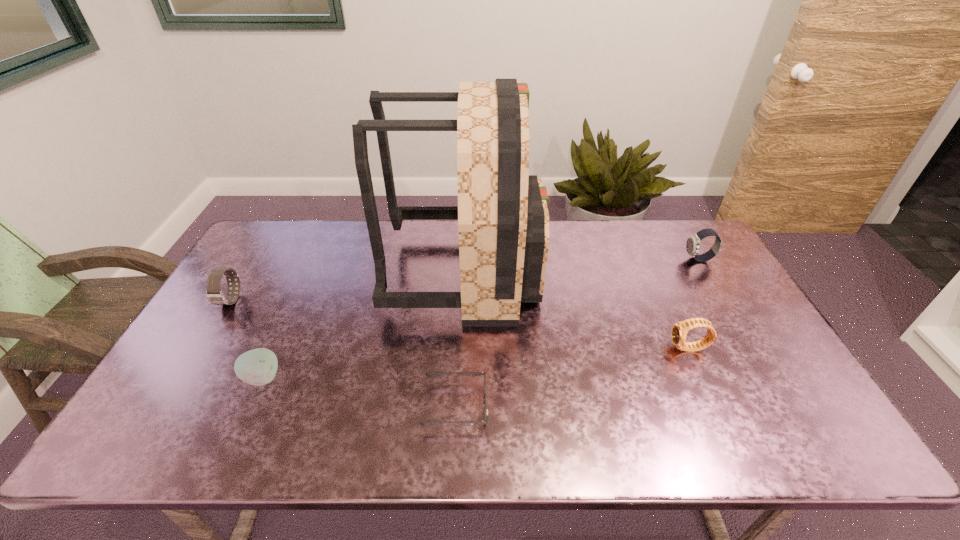
Locate an element on the screen. The height and width of the screenshot is (540, 960). watch present at the far edge is located at coordinates (693, 242).

The width and height of the screenshot is (960, 540). Find the location of `object present at the near edge`. object present at the near edge is located at coordinates (426, 423).

At what (x,y) coordinates should I click in order to perform the action: click on object that is at the left edge. Please return your answer as a coordinate pair (x, y). Looking at the image, I should click on (214, 294).

Identify the location of object present at the right edge. (693, 242).

Where is `object that is at the far right corner`? The height and width of the screenshot is (540, 960). object that is at the far right corner is located at coordinates (693, 242).

In the image, there is a desktop. At what (x,y) coordinates should I click in order to perform the action: click on free space at the far edge. Please return your answer as a coordinate pair (x, y). The image size is (960, 540). Looking at the image, I should click on (349, 251).

In the image, there is a desktop. At what (x,y) coordinates should I click in order to perform the action: click on vacant space at the right edge. Please return your answer as a coordinate pair (x, y). The width and height of the screenshot is (960, 540). Looking at the image, I should click on (718, 316).

In the image, there is a desktop. At what (x,y) coordinates should I click in order to perform the action: click on free space at the far left corner. Please return your answer as a coordinate pair (x, y). The width and height of the screenshot is (960, 540). Looking at the image, I should click on (277, 226).

The image size is (960, 540). In the image, there is a desktop. Find the location of `free region at the near left corner`. free region at the near left corner is located at coordinates 196,421.

This screenshot has width=960, height=540. I want to click on free region at the far right corner, so click(x=683, y=230).